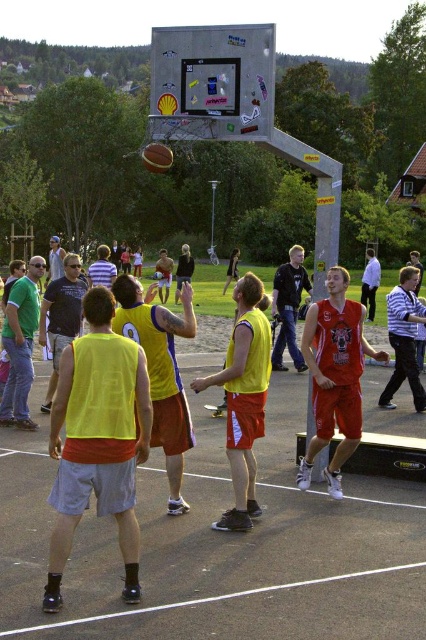
You are a spectator at the basketball game and want to locate both the neon yellow jersey at left and the matte yellow jersey at center. Which one is positioned more to the right side of the court?

The neon yellow jersey at left is positioned more to the right side of the court compared to the matte yellow jersey at center.

You are a basketball player trying to shoot the ball into the hoop. Considering the height of the metallic gray basketball hoop at upper center compared to the neon yellow jersey at left, do you think you need to jump higher to make the shot?

The metallic gray basketball hoop at upper center is much taller than the neon yellow jersey at left, so yes, you need to jump higher to reach the hoop and make the shot.